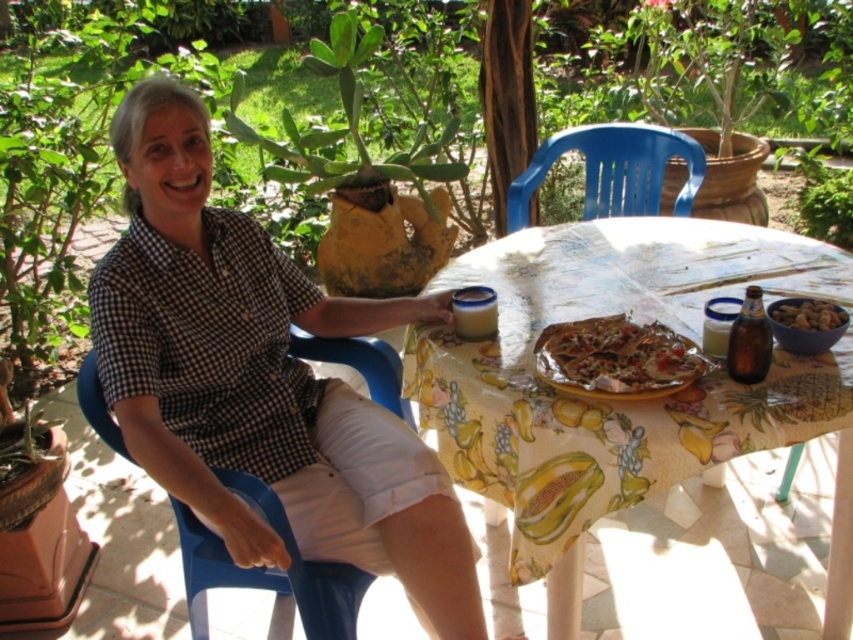
Question: Does yellow printed tablecloth at center appear on the left side of blue plastic chair at upper center?

Choices:
 (A) no
 (B) yes

Answer: (B)

Question: Estimate the real-world distances between objects in this image. Which object is closer to the blue plastic chair at left?

Choices:
 (A) checkered fabric shirt at center
 (B) blue plastic chair at upper center

Answer: (A)

Question: Does yellow printed tablecloth at center appear on the right side of blue plastic chair at upper center?

Choices:
 (A) no
 (B) yes

Answer: (A)

Question: Which object is positioned farthest from the blue plastic chair at left?

Choices:
 (A) blue plastic chair at upper center
 (B) checkered fabric shirt at center

Answer: (A)

Question: In this image, where is yellow printed tablecloth at center located relative to crusty golden pizza at center?

Choices:
 (A) right
 (B) left

Answer: (A)

Question: Which object is the closest to the checkered fabric shirt at center?

Choices:
 (A) brown matte nuts at center
 (B) crusty golden pizza at center
 (C) blue plastic chair at left

Answer: (C)